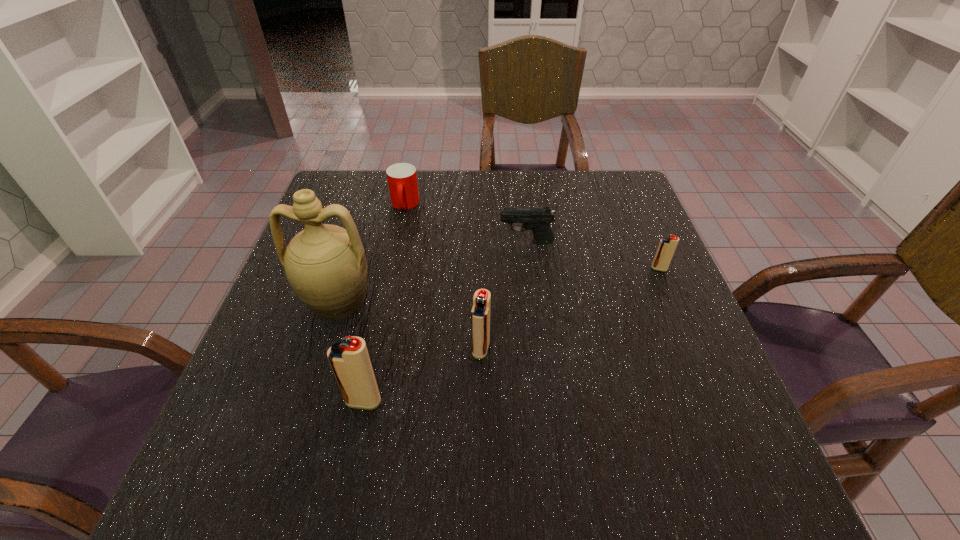
Where is `vacant space that's between the third nearest object and the cup`? vacant space that's between the third nearest object and the cup is located at coordinates (371, 253).

At what (x,y) coordinates should I click in order to perform the action: click on empty space that is in between the cup and the fourth farthest object. Please return your answer as a coordinate pair (x, y). The width and height of the screenshot is (960, 540). Looking at the image, I should click on (371, 253).

Find the location of a particular element. The height and width of the screenshot is (540, 960). free area in between the nearest object and the cup is located at coordinates (384, 303).

At what (x,y) coordinates should I click in order to perform the action: click on vacant area that lies between the second object from right to left and the cup. Please return your answer as a coordinate pair (x, y). Looking at the image, I should click on point(466,224).

This screenshot has width=960, height=540. I want to click on empty location between the tallest object and the farthest igniter, so click(498, 285).

Image resolution: width=960 pixels, height=540 pixels. Find the location of `blank region between the farthest object and the rightmost object`. blank region between the farthest object and the rightmost object is located at coordinates (532, 237).

The width and height of the screenshot is (960, 540). Identify the location of unoccupied position between the third object from right to left and the farthest object. [443, 277].

Where is `blank region between the farthest object and the second object from right to left`? The height and width of the screenshot is (540, 960). blank region between the farthest object and the second object from right to left is located at coordinates (466, 224).

I want to click on free space between the pitcher and the farthest object, so click(371, 253).

This screenshot has height=540, width=960. Find the location of `free point between the second shortest igniter and the tallest object`. free point between the second shortest igniter and the tallest object is located at coordinates (409, 325).